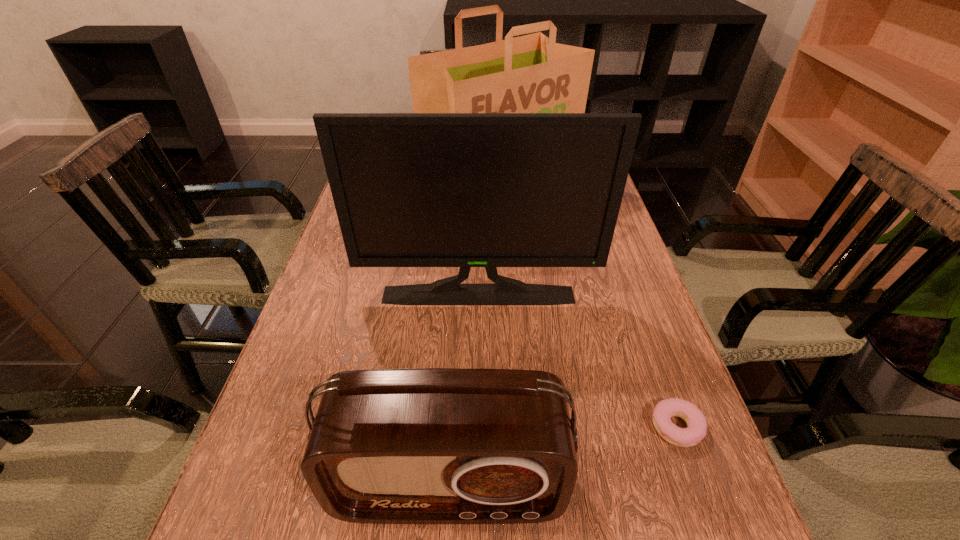
Identify the location of object identified as the second closest to the second shortest object. (465, 190).

At what (x,y) coordinates should I click in order to perform the action: click on vacant space that satisfies the following two spatial constraints: 1. on the front-facing side of the shortest object; 2. on the left side of the monitor. Please return your answer as a coordinate pair (x, y). Looking at the image, I should click on (477, 427).